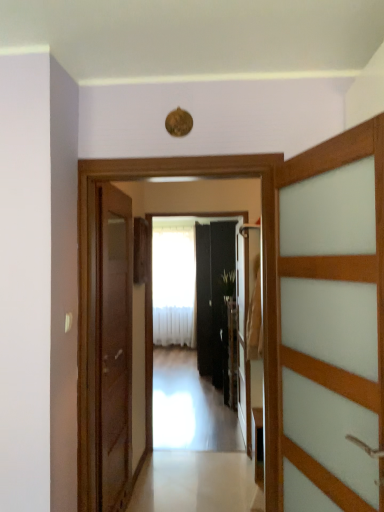
Question: Considering the relative positions of transparent glass elevator at center and wooden door at left, placed as the second door when sorted from back to front, in the image provided, is transparent glass elevator at center in front of wooden door at left, placed as the second door when sorted from back to front,?

Choices:
 (A) no
 (B) yes

Answer: (B)

Question: Does transparent glass elevator at center have a smaller size compared to wooden door at left, positioned as the 2th door in front-to-back order?

Choices:
 (A) yes
 (B) no

Answer: (B)

Question: Does transparent glass elevator at center have a greater height compared to wooden door at left, the third door in the right-to-left sequence?

Choices:
 (A) yes
 (B) no

Answer: (B)

Question: Considering the relative sizes of transparent glass elevator at center and wooden door at left, the third door in the right-to-left sequence, in the image provided, is transparent glass elevator at center shorter than wooden door at left, the third door in the right-to-left sequence,?

Choices:
 (A) no
 (B) yes

Answer: (B)

Question: From a real-world perspective, does transparent glass elevator at center sit lower than wooden door at left, positioned as the 2th door in front-to-back order?

Choices:
 (A) no
 (B) yes

Answer: (A)

Question: Is black glossy door at center, arranged as the 1th door when viewed from the right, inside the boundaries of wooden door at left, placed as the second door when sorted from back to front, or outside?

Choices:
 (A) inside
 (B) outside

Answer: (B)

Question: Considering the positions of black glossy door at center, arranged as the 1th door when viewed from the right, and wooden door at left, positioned as the 2th door in front-to-back order, in the image, is black glossy door at center, arranged as the 1th door when viewed from the right, taller or shorter than wooden door at left, positioned as the 2th door in front-to-back order,?

Choices:
 (A) tall
 (B) short

Answer: (A)

Question: From the image's perspective, is black glossy door at center, which is the 3th door from left to right, above or below wooden door at left, positioned as the 2th door in front-to-back order?

Choices:
 (A) below
 (B) above

Answer: (B)

Question: Considering the positions of point (233, 276) and point (102, 508), is point (233, 276) closer or farther from the camera than point (102, 508)?

Choices:
 (A) closer
 (B) farther

Answer: (B)

Question: Relative to green leafy plant at center, is wooden door at left, placed as the second door when sorted from back to front, in front or behind?

Choices:
 (A) behind
 (B) front

Answer: (B)

Question: From the image's perspective, relative to green leafy plant at center, is wooden door at left, acting as the 1th door starting from the left, above or below?

Choices:
 (A) below
 (B) above

Answer: (A)

Question: Is wooden door at left, acting as the 1th door starting from the left, inside or outside of green leafy plant at center?

Choices:
 (A) outside
 (B) inside

Answer: (A)

Question: Would you say wooden door at left, acting as the 1th door starting from the left, is to the left or to the right of green leafy plant at center in the picture?

Choices:
 (A) left
 (B) right

Answer: (A)

Question: Considering the positions of white sheer curtain at center and white glossy floor at center in the image, is white sheer curtain at center taller or shorter than white glossy floor at center?

Choices:
 (A) short
 (B) tall

Answer: (B)

Question: From a real-world perspective, relative to white glossy floor at center, is white sheer curtain at center vertically above or below?

Choices:
 (A) below
 (B) above

Answer: (B)